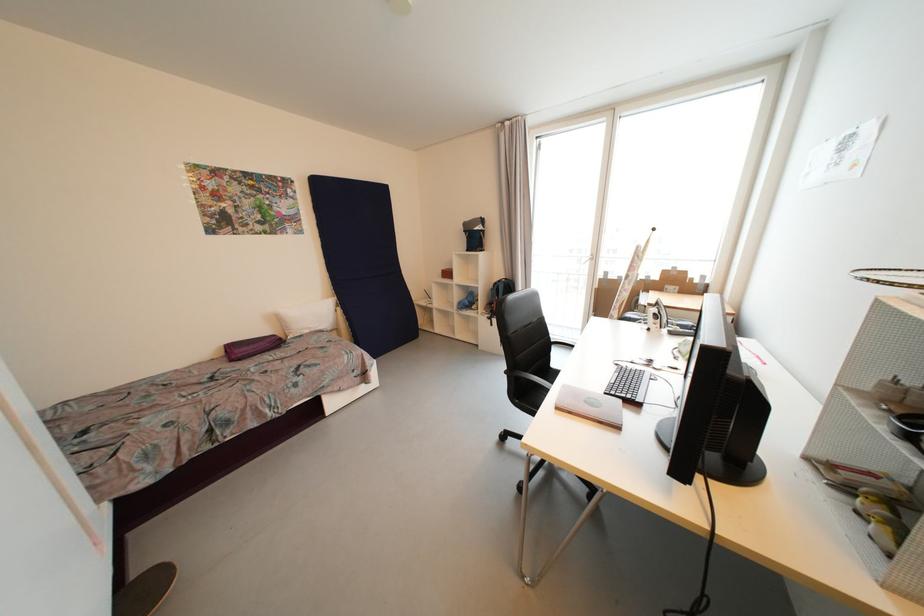
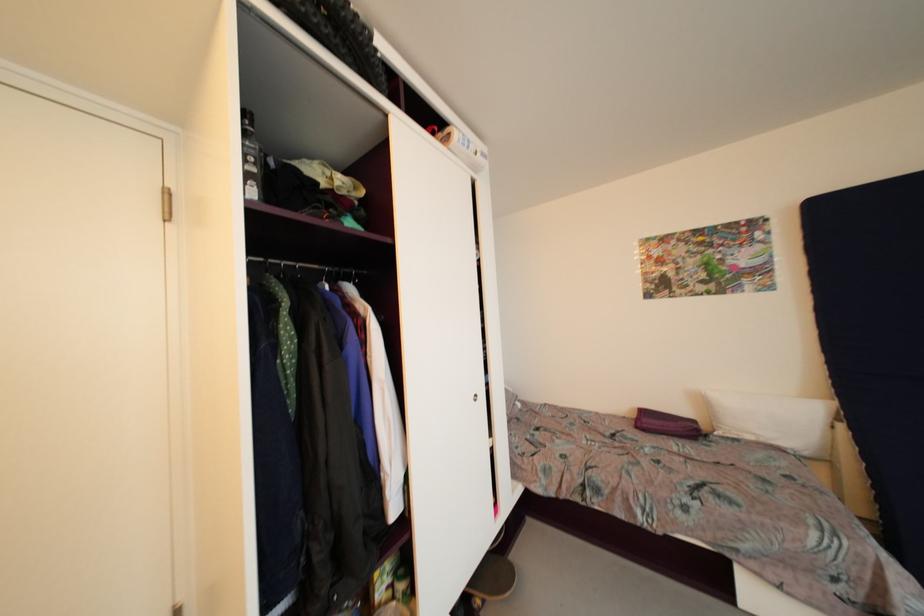
Where in the second image is the point corresponding to (334,331) from the first image?

(810, 456)